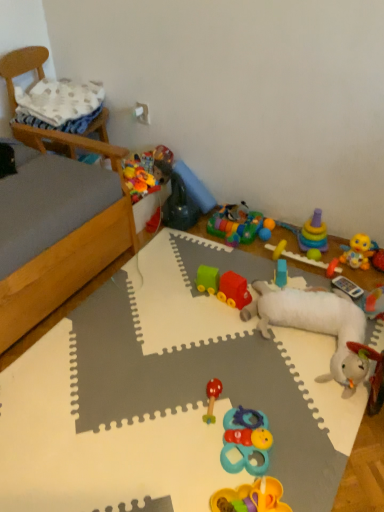
Find the location of a particular element. This screenshot has height=512, width=384. free area in between rubberized plastic train at center, the 7th toy when ordered from top to bottom, and white plush sheep at center, the 8th toy viewed from the top is located at coordinates (228, 307).